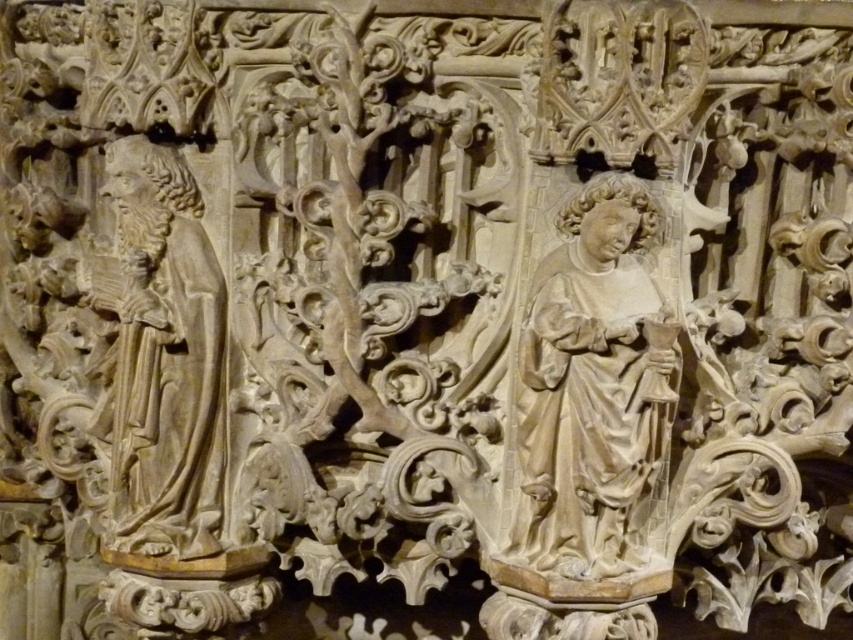
Between smooth beige statue at center and carved stone figure at left, which one is positioned lower?

Positioned lower is smooth beige statue at center.

Is smooth beige statue at center bigger than carved stone figure at left?

Actually, smooth beige statue at center might be smaller than carved stone figure at left.

Does point (550, 336) come in front of point (107, 419)?

That is True.

Image resolution: width=853 pixels, height=640 pixels. I want to click on smooth beige statue at center, so click(595, 387).